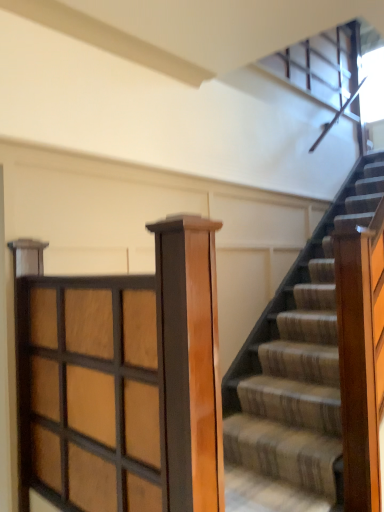
What is the approximate width of wooden grid at center?

It is 4.62 centimeters.

The width and height of the screenshot is (384, 512). What do you see at coordinates (124, 382) in the screenshot?
I see `wooden grid at center` at bounding box center [124, 382].

Identify the location of wooden grid at center. (124, 382).

You are a GUI agent. You are given a task and a screenshot of the screen. Output one action in this format:
    pyautogui.click(x=<x>, y=<y>)
    Task: Click on the wooden grid at center
    Image resolution: width=384 pixels, height=512 pixels.
    Given the screenshot: What is the action you would take?
    pyautogui.click(x=124, y=382)